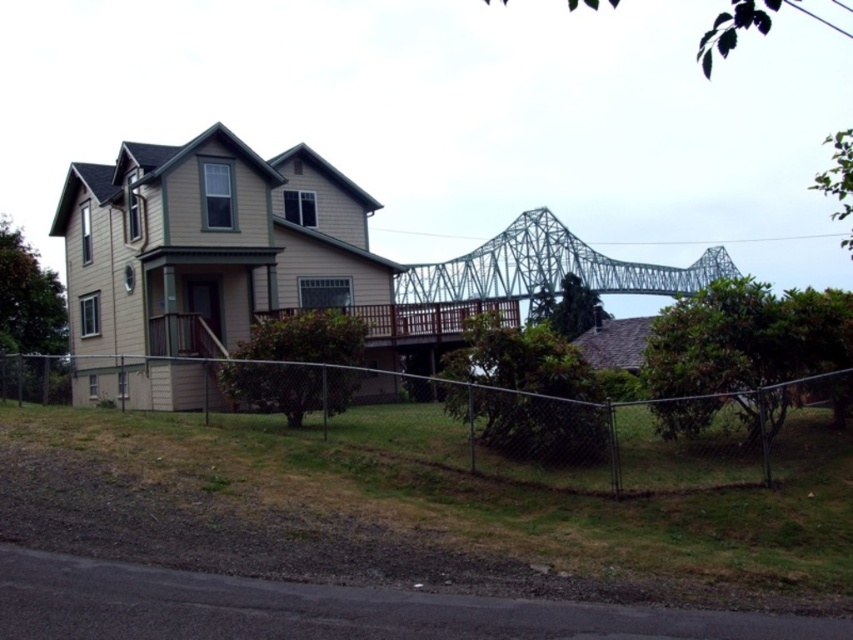
Is chain-link fence at lower center closer to camera compared to green metallic bridge at upper center?

Yes, it is in front of green metallic bridge at upper center.

Does chain-link fence at lower center have a lesser width compared to green metallic bridge at upper center?

Correct, chain-link fence at lower center's width is less than green metallic bridge at upper center's.

Is point (531, 401) closer to camera compared to point (509, 224)?

Yes, it is.

The width and height of the screenshot is (853, 640). I want to click on chain-link fence at lower center, so click(x=518, y=422).